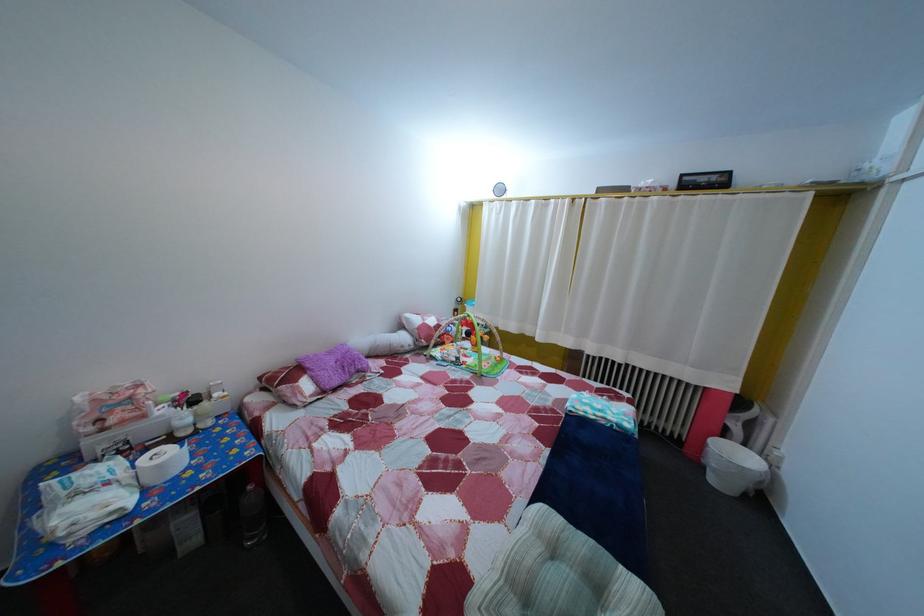
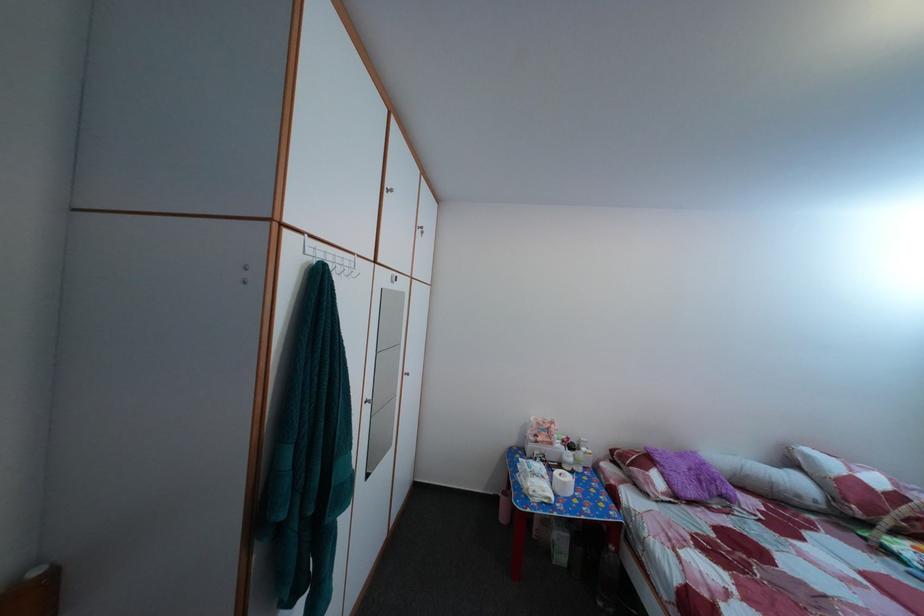
Find the pixel in the second image that matches point 195,402 in the first image.

(578, 447)